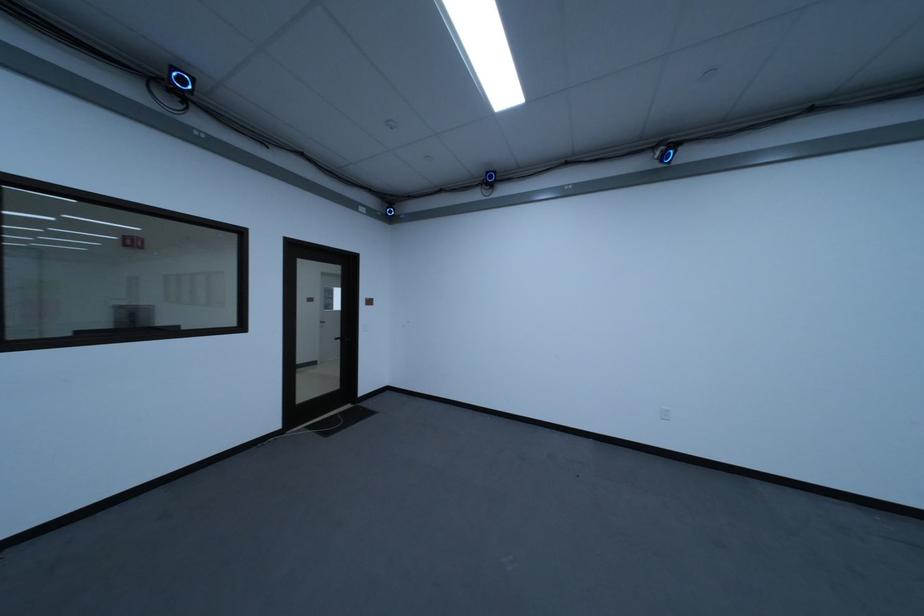
The image size is (924, 616). What do you see at coordinates (347, 341) in the screenshot?
I see `a black door handle` at bounding box center [347, 341].